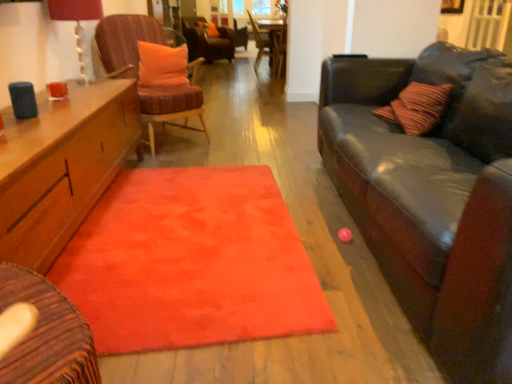
Question: From the image's perspective, is velvet brown armchair at center below orange fabric pillow at upper center, placed as the 1th pillow when sorted from bottom to top?

Choices:
 (A) no
 (B) yes

Answer: (A)

Question: Can you confirm if velvet brown armchair at center is bigger than orange fabric pillow at upper center, placed as the 1th pillow when sorted from bottom to top?

Choices:
 (A) yes
 (B) no

Answer: (A)

Question: From a real-world perspective, does velvet brown armchair at center sit lower than orange fabric pillow at upper center, placed as the 1th pillow when sorted from bottom to top?

Choices:
 (A) yes
 (B) no

Answer: (A)

Question: Is the depth of velvet brown armchair at center greater than that of orange fabric pillow at upper center, the 2th pillow when ordered from back to front?

Choices:
 (A) no
 (B) yes

Answer: (B)

Question: Does velvet brown armchair at center have a greater height compared to orange fabric pillow at upper center, placed as the 1th pillow when sorted from bottom to top?

Choices:
 (A) yes
 (B) no

Answer: (A)

Question: Is matte glass lampshade at upper left wider or thinner than fluffy orange rug at center?

Choices:
 (A) thin
 (B) wide

Answer: (A)

Question: In the image, is matte glass lampshade at upper left on the left side or the right side of fluffy orange rug at center?

Choices:
 (A) left
 (B) right

Answer: (A)

Question: Is point (53, 0) closer or farther from the camera than point (204, 183)?

Choices:
 (A) closer
 (B) farther

Answer: (A)

Question: From a real-world perspective, is matte glass lampshade at upper left positioned above or below fluffy orange rug at center?

Choices:
 (A) below
 (B) above

Answer: (B)

Question: Considering the positions of point (216, 44) and point (169, 92), is point (216, 44) closer or farther from the camera than point (169, 92)?

Choices:
 (A) farther
 (B) closer

Answer: (A)

Question: Considering their positions, is velvet orange chair at center, which is the 3th chair from front to back, located in front of or behind velvet orange chair at left, acting as the first chair starting from the bottom?

Choices:
 (A) front
 (B) behind

Answer: (B)

Question: From a real-world perspective, is velvet orange chair at center, which is the 3th chair from front to back, physically located above or below velvet orange chair at left, arranged as the 3th chair when viewed from the top?

Choices:
 (A) below
 (B) above

Answer: (A)

Question: Considering the positions of velvet orange chair at center, arranged as the 1th chair when viewed from the top, and velvet orange chair at left, which is the first chair in front-to-back order, in the image, is velvet orange chair at center, arranged as the 1th chair when viewed from the top, wider or thinner than velvet orange chair at left, which is the first chair in front-to-back order,?

Choices:
 (A) thin
 (B) wide

Answer: (B)

Question: Would you say matte glass lampshade at upper left is to the left or to the right of orange fabric pillow at upper center, which is the 1th pillow in front-to-back order, in the picture?

Choices:
 (A) left
 (B) right

Answer: (A)

Question: Is point (54, 1) closer or farther from the camera than point (155, 66)?

Choices:
 (A) closer
 (B) farther

Answer: (A)